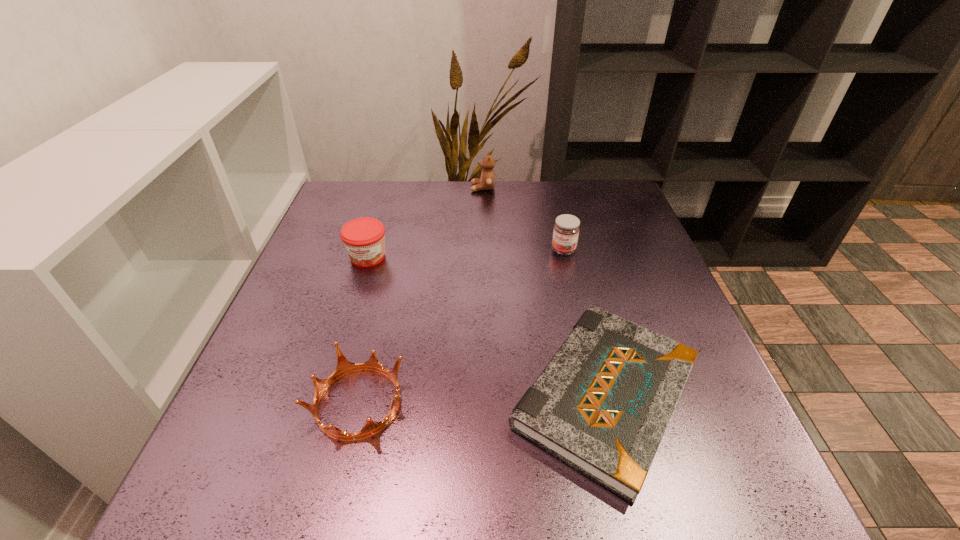
Identify the location of vacant point located on the label side of the left jam. (350, 314).

The width and height of the screenshot is (960, 540). Identify the location of vacant position located on the back of the crown. (394, 254).

In order to click on free space located on the left of the shortest object in this screenshot , I will do `click(348, 395)`.

Find the location of a particular element. The image size is (960, 540). object located in the far edge section of the desktop is located at coordinates (487, 181).

You are a GUI agent. You are given a task and a screenshot of the screen. Output one action in this format:
    pyautogui.click(x=<x>, y=<y>)
    Task: Click on the object that is at the near edge
    The image size is (960, 540).
    Given the screenshot: What is the action you would take?
    pyautogui.click(x=602, y=404)

The width and height of the screenshot is (960, 540). I want to click on jam located at the left edge, so click(364, 238).

The image size is (960, 540). What are the coordinates of `crown present at the left edge` in the screenshot? It's located at (344, 367).

You are a GUI agent. You are given a task and a screenshot of the screen. Output one action in this format:
    pyautogui.click(x=<x>, y=<y>)
    Task: Click on the object present at the right edge
    The width and height of the screenshot is (960, 540).
    Given the screenshot: What is the action you would take?
    pyautogui.click(x=602, y=404)

Where is `object positioned at the near right corner`? This screenshot has height=540, width=960. object positioned at the near right corner is located at coordinates (602, 404).

The image size is (960, 540). In order to click on vacant space at the far edge of the desktop in this screenshot , I will do `click(476, 194)`.